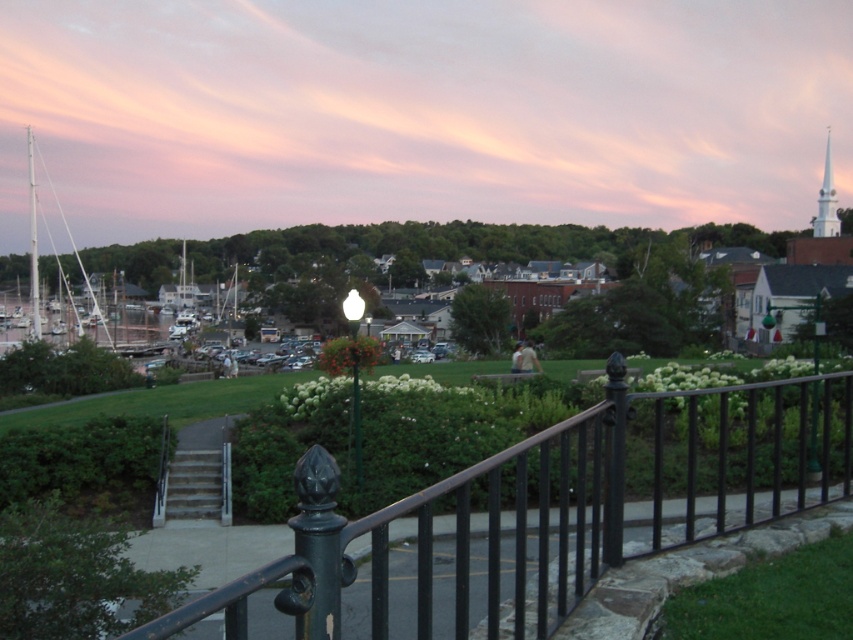
Is gray concrete stairs at lower left wider than white matte sailboat at left?

No, gray concrete stairs at lower left is not wider than white matte sailboat at left.

Between gray concrete stairs at lower left and white matte sailboat at left, which one has less height?

gray concrete stairs at lower left

Between point (223, 481) and point (33, 220), which one is positioned in front?

Point (223, 481) is in front.

In order to click on gray concrete stairs at lower left in this screenshot , I will do `click(196, 476)`.

Can you confirm if black metal fence at center is shorter than white matte sailboat at left?

Correct, black metal fence at center is not as tall as white matte sailboat at left.

Is black metal fence at center bigger than white matte sailboat at left?

No, black metal fence at center is not bigger than white matte sailboat at left.

Does point (325, 464) come behind point (32, 182)?

No, it is in front of (32, 182).

Locate an element on the screen. The image size is (853, 640). black metal fence at center is located at coordinates (544, 509).

Image resolution: width=853 pixels, height=640 pixels. What do you see at coordinates (421, 113) in the screenshot? I see `pink sky at upper center` at bounding box center [421, 113].

Does pink sky at upper center have a lesser width compared to black metal fence at center?

No, pink sky at upper center is not thinner than black metal fence at center.

Describe the element at coordinates (421, 113) in the screenshot. The width and height of the screenshot is (853, 640). I see `pink sky at upper center` at that location.

Identify the location of pink sky at upper center. (421, 113).